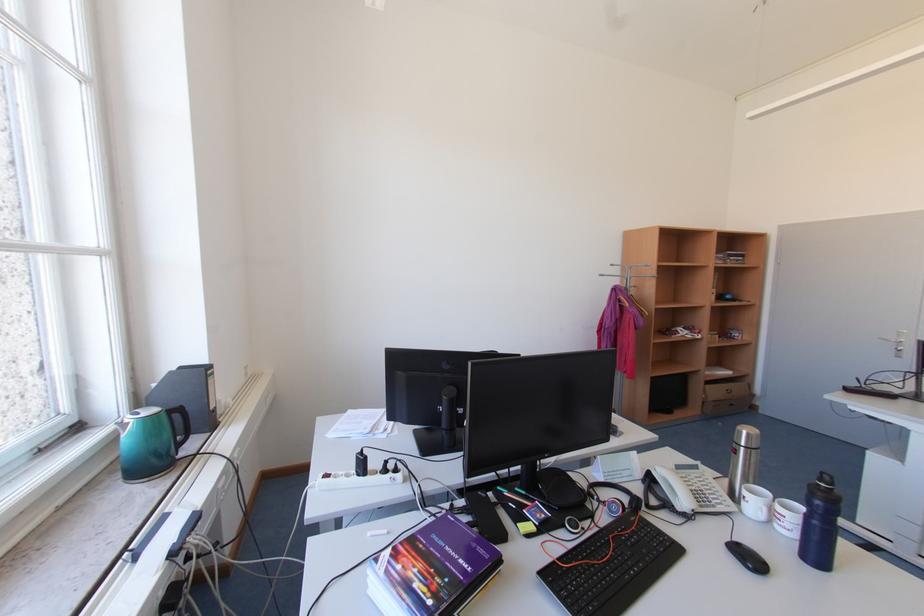
At what (x,y) coordinates should I click in order to perform the action: click on silver door handle. Please return your answer as a coordinate pair (x, y). Looking at the image, I should click on (894, 339).